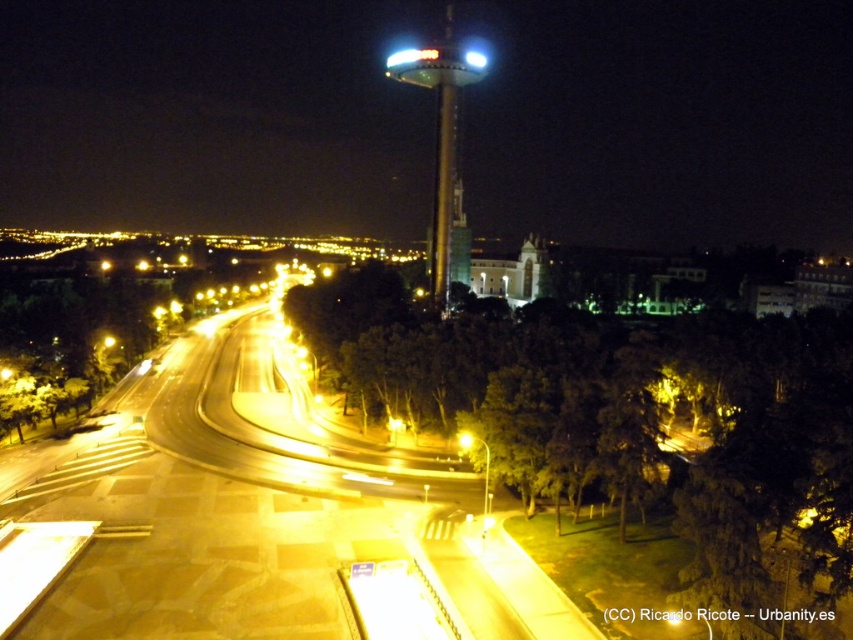
You are a pedestrian standing on the road and looking towards the shiny metallic tower at center. Can you see the yellow metallic streetlight at center from your current position?

The yellow metallic streetlight at center is behind the shiny metallic tower at center, so it is obstructed from view. Therefore, you cannot see the yellow metallic streetlight at center from your current position.

You are standing at point A, which is located at coordinates (440, 138) in the image. You want to walk towards the shiny metallic tower at center. Which direction should you head?

The point at (440, 138) is exactly where the shiny metallic tower at center is located, so you are already at the tower.